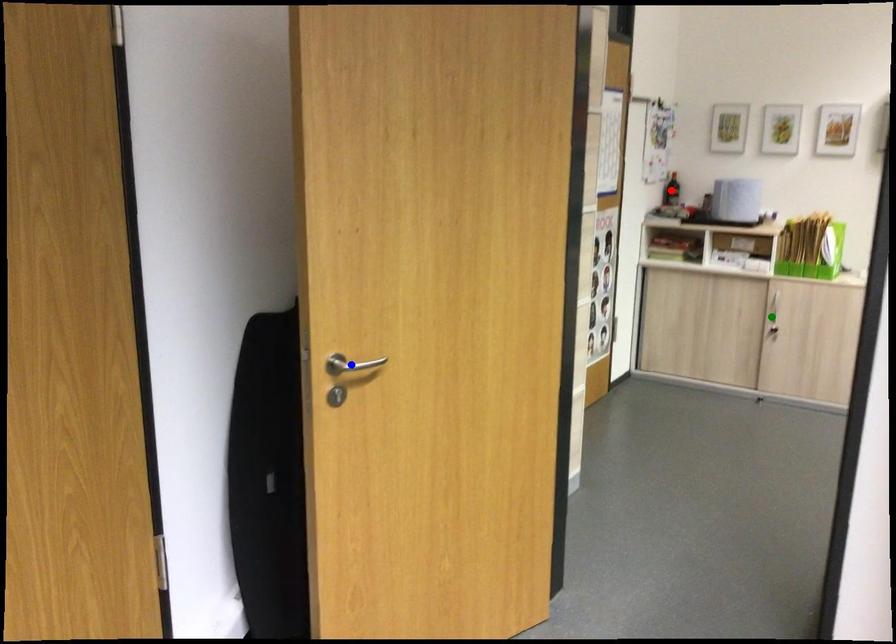
Order these from nearest to farthest:
- green point
- red point
- blue point

blue point < green point < red point